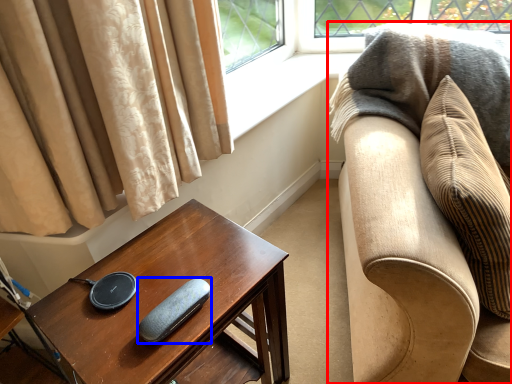
Question: Which object appears farthest to the camera in this image, studio couch (highlighted by a red box) or pad (highlighted by a blue box)?

Choices:
 (A) studio couch
 (B) pad

Answer: (B)